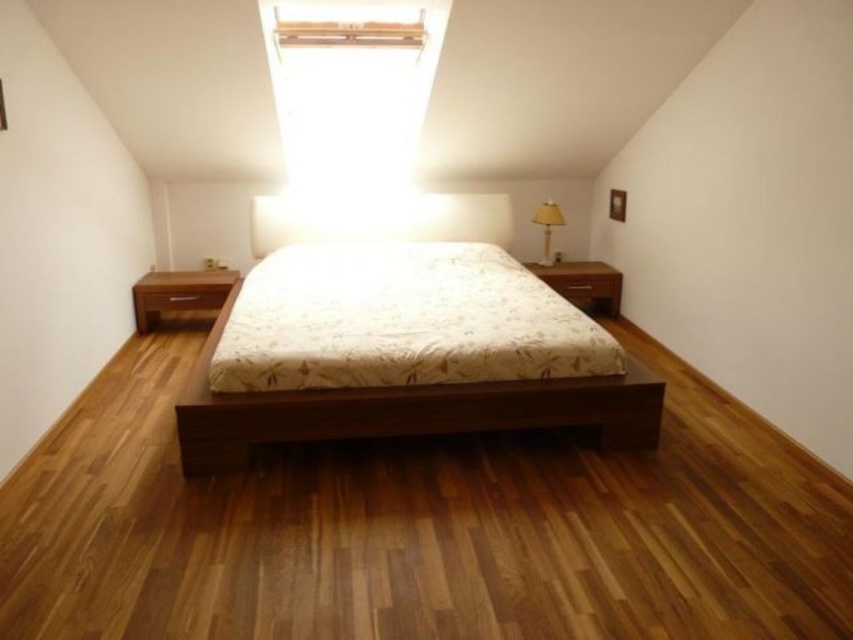
Question: Which object is positioned closest to the yellow fabric lampshade at right?

Choices:
 (A) transparent glass skylight at upper center
 (B) brown matte drawer at right

Answer: (B)

Question: Can you confirm if transparent glass skylight at upper center is positioned to the left of brown matte drawer at right?

Choices:
 (A) yes
 (B) no

Answer: (A)

Question: Which object appears closest to the camera in this image?

Choices:
 (A) matte wood bed at center
 (B) matte brown drawer at left
 (C) wooden nightstand at left

Answer: (A)

Question: Among these points, which one is farthest from the camera?

Choices:
 (A) (560, 324)
 (B) (444, 404)
 (C) (171, 304)

Answer: (C)

Question: From the image, what is the correct spatial relationship of floral fabric mattress at center in relation to transparent glass skylight at upper center?

Choices:
 (A) left
 (B) right

Answer: (B)

Question: Can you confirm if floral fabric mattress at center is bigger than dark brown wood bed frame at center?

Choices:
 (A) no
 (B) yes

Answer: (B)